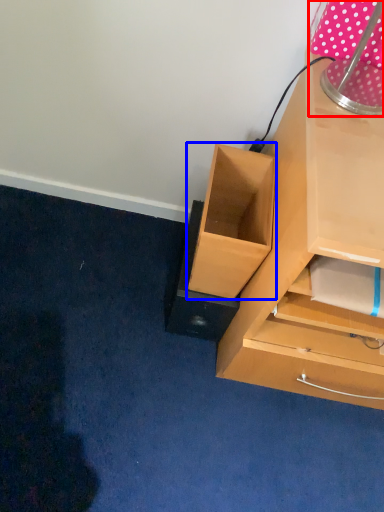
Question: Among these objects, which one is nearest to the camera, table lamp (highlighted by a red box) or drawer (highlighted by a blue box)?

Choices:
 (A) table lamp
 (B) drawer

Answer: (A)